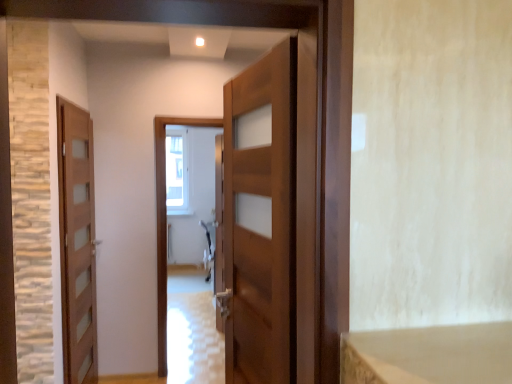
Identify the location of glossy wooden door at center. (186, 334).

Where is `clear glass window at center`? clear glass window at center is located at coordinates (177, 172).

Is wooden door at center, marked as the 2th door in a left-to-right arrangement, beside wooden door at left, which is the 2th door in front-to-back order?

No, wooden door at center, marked as the 2th door in a left-to-right arrangement, is not touching wooden door at left, which is the 2th door in front-to-back order.

Consider the image. From a real-world perspective, is wooden door at center, positioned as the first door in right-to-left order, physically located above or below wooden door at left, acting as the 2th door starting from the right?

Clearly, from a real-world perspective, wooden door at center, positioned as the first door in right-to-left order, is above wooden door at left, acting as the 2th door starting from the right.

In terms of height, does wooden door at center, positioned as the first door in right-to-left order, look taller or shorter compared to wooden door at left, acting as the 2th door starting from the right?

Considering their sizes, wooden door at center, positioned as the first door in right-to-left order, has less height than wooden door at left, acting as the 2th door starting from the right.

Considering the positions of points (286, 377) and (64, 254), is point (286, 377) closer to camera compared to point (64, 254)?

Yes, it is.

Is point (167, 377) closer or farther from the camera than point (179, 208)?

Point (167, 377) is closer to the camera than point (179, 208).

Are glossy wooden door at center and clear glass window at center making contact?

They are not placed beside each other.

Which object is more forward, glossy wooden door at center or clear glass window at center?

glossy wooden door at center is more forward.

Do you think glossy wooden door at center is within clear glass window at center, or outside of it?

glossy wooden door at center is not enclosed by clear glass window at center.

Between point (81, 186) and point (284, 375), which one is positioned in front?

The point (284, 375) is closer.

From the picture: Considering the sizes of objects wooden door at left, marked as the first door in a back-to-front arrangement, and wooden door at center, marked as the 2th door in a back-to-front arrangement, in the image provided, who is taller, wooden door at left, marked as the first door in a back-to-front arrangement, or wooden door at center, marked as the 2th door in a back-to-front arrangement,?

wooden door at left, marked as the first door in a back-to-front arrangement, is taller.

Where is `door that appears below the wooden door at center, positioned as the first door in right-to-left order (from the image's perspective)`? door that appears below the wooden door at center, positioned as the first door in right-to-left order (from the image's perspective) is located at coordinates (77, 243).

From their relative heights in the image, would you say wooden door at left, marked as the first door in a back-to-front arrangement, is taller or shorter than glossy wooden door at center?

In the image, wooden door at left, marked as the first door in a back-to-front arrangement, appears to be taller than glossy wooden door at center.

Is wooden door at left, marked as the first door in a back-to-front arrangement, placed right next to glossy wooden door at center?

They are not placed beside each other.

Is wooden door at left, acting as the 2th door starting from the right, aimed at glossy wooden door at center?

No, wooden door at left, acting as the 2th door starting from the right, is not turned towards glossy wooden door at center.

How much distance is there between wooden door at left, which is the 2th door in front-to-back order, and glossy wooden door at center?

A distance of 1.34 meters exists between wooden door at left, which is the 2th door in front-to-back order, and glossy wooden door at center.

Locate an element on the screen. The width and height of the screenshot is (512, 384). window above the wooden door at center, marked as the 2th door in a back-to-front arrangement (from the image's perspective) is located at coordinates (177, 172).

From a real-world perspective, is clear glass window at center positioned under wooden door at center, which ranks as the 1th door in front-to-back order, based on gravity?

Incorrect, from a real-world perspective, clear glass window at center is higher than wooden door at center, which ranks as the 1th door in front-to-back order.

Is clear glass window at center positioned with its back to wooden door at center, positioned as the first door in right-to-left order?

No, clear glass window at center is not facing the opposite direction of wooden door at center, positioned as the first door in right-to-left order.

Is clear glass window at center outside of wooden door at center, positioned as the first door in right-to-left order?

Yes, clear glass window at center is not within wooden door at center, positioned as the first door in right-to-left order.

Considering the relative sizes of wooden door at center, which ranks as the 1th door in front-to-back order, and clear glass window at center in the image provided, is wooden door at center, which ranks as the 1th door in front-to-back order, bigger than clear glass window at center?

Indeed, wooden door at center, which ranks as the 1th door in front-to-back order, has a larger size compared to clear glass window at center.

In the scene shown: Which object is further away from the camera taking this photo, wooden door at center, positioned as the first door in right-to-left order, or clear glass window at center?

Positioned behind is clear glass window at center.

Considering the sizes of objects wooden door at center, which ranks as the 1th door in front-to-back order, and clear glass window at center in the image provided, who is thinner, wooden door at center, which ranks as the 1th door in front-to-back order, or clear glass window at center?

clear glass window at center is thinner.

In terms of height, does wooden door at center, marked as the 2th door in a back-to-front arrangement, look taller or shorter compared to clear glass window at center?

Clearly, wooden door at center, marked as the 2th door in a back-to-front arrangement, is shorter compared to clear glass window at center.

In the image, is clear glass window at center positioned in front of or behind glossy wooden door at center?

clear glass window at center is positioned farther from the viewer than glossy wooden door at center.

From a real-world perspective, does clear glass window at center sit lower than glossy wooden door at center?

Incorrect, from a real-world perspective, clear glass window at center is higher than glossy wooden door at center.

Are clear glass window at center and glossy wooden door at center located far from each other?

Yes, clear glass window at center is far from glossy wooden door at center.

In the scene shown: Which point is more forward, (177, 139) or (219, 380)?

Positioned in front is point (219, 380).

Image resolution: width=512 pixels, height=384 pixels. Identify the location of door lying below the wooden door at center, which ranks as the 1th door in front-to-back order (from the image's perspective). (77, 243).

You are a GUI agent. You are given a task and a screenshot of the screen. Output one action in this format:
    pyautogui.click(x=<x>, y=<y>)
    Task: Click on the window that appears above the glossy wooden door at center (from a real-world perspective)
    Image resolution: width=512 pixels, height=384 pixels.
    Given the screenshot: What is the action you would take?
    pyautogui.click(x=177, y=172)

Based on their spatial positions, is clear glass window at center or glossy wooden door at center closer to wooden door at center, marked as the 2th door in a back-to-front arrangement?

Based on the image, glossy wooden door at center appears to be nearer to wooden door at center, marked as the 2th door in a back-to-front arrangement.

Estimate the real-world distances between objects in this image. Which object is further from clear glass window at center, wooden door at left, acting as the 2th door starting from the right, or glossy wooden door at center?

wooden door at left, acting as the 2th door starting from the right.

Which object lies further to the anchor point wooden door at left, which is the 2th door in front-to-back order, glossy wooden door at center or clear glass window at center?

clear glass window at center.

Which object lies nearer to the anchor point wooden door at left, which ranks as the first door in left-to-right order, wooden door at center, which ranks as the 1th door in front-to-back order, or glossy wooden door at center?

Among the two, glossy wooden door at center is located nearer to wooden door at left, which ranks as the first door in left-to-right order.

Which object lies nearer to the anchor point wooden door at center, marked as the 2th door in a back-to-front arrangement, clear glass window at center or wooden door at left, marked as the first door in a back-to-front arrangement?

wooden door at left, marked as the first door in a back-to-front arrangement, lies closer to wooden door at center, marked as the 2th door in a back-to-front arrangement, than the other object.

Looking at the image, which one is located closer to glossy wooden door at center, wooden door at left, which ranks as the first door in left-to-right order, or clear glass window at center?

wooden door at left, which ranks as the first door in left-to-right order, lies closer to glossy wooden door at center than the other object.

Estimate the real-world distances between objects in this image. Which object is further from wooden door at center, marked as the 2th door in a back-to-front arrangement, glossy wooden door at center or wooden door at left, which ranks as the first door in left-to-right order?

glossy wooden door at center is further to wooden door at center, marked as the 2th door in a back-to-front arrangement.

Looking at the image, which one is located closer to clear glass window at center, wooden door at left, acting as the 2th door starting from the right, or wooden door at center, marked as the 2th door in a back-to-front arrangement?

Among the two, wooden door at left, acting as the 2th door starting from the right, is located nearer to clear glass window at center.

Identify the location of door positioned between wooden door at center, marked as the 2th door in a left-to-right arrangement, and clear glass window at center from near to far. This screenshot has width=512, height=384. (77, 243).

Identify the location of door between wooden door at center, which ranks as the 1th door in front-to-back order, and glossy wooden door at center, along the z-axis. This screenshot has width=512, height=384. (77, 243).

Where is `path positioned between wooden door at left, which is the 2th door in front-to-back order, and clear glass window at center from near to far`? This screenshot has height=384, width=512. path positioned between wooden door at left, which is the 2th door in front-to-back order, and clear glass window at center from near to far is located at coordinates [x=186, y=334].

Locate an element on the screen. The width and height of the screenshot is (512, 384). path between wooden door at center, which ranks as the 1th door in front-to-back order, and clear glass window at center from front to back is located at coordinates (186, 334).